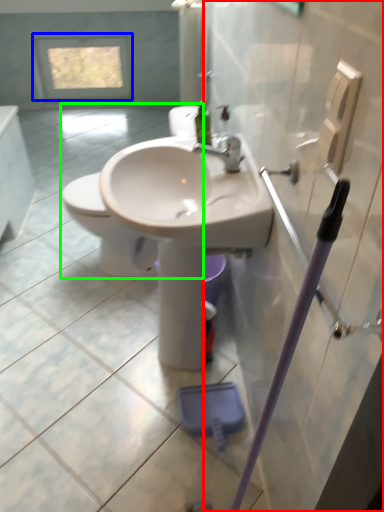
Question: Which is nearer to the screen door (highlighted by a red box)? window (highlighted by a blue box) or toilet (highlighted by a green box).

Choices:
 (A) window
 (B) toilet

Answer: (B)